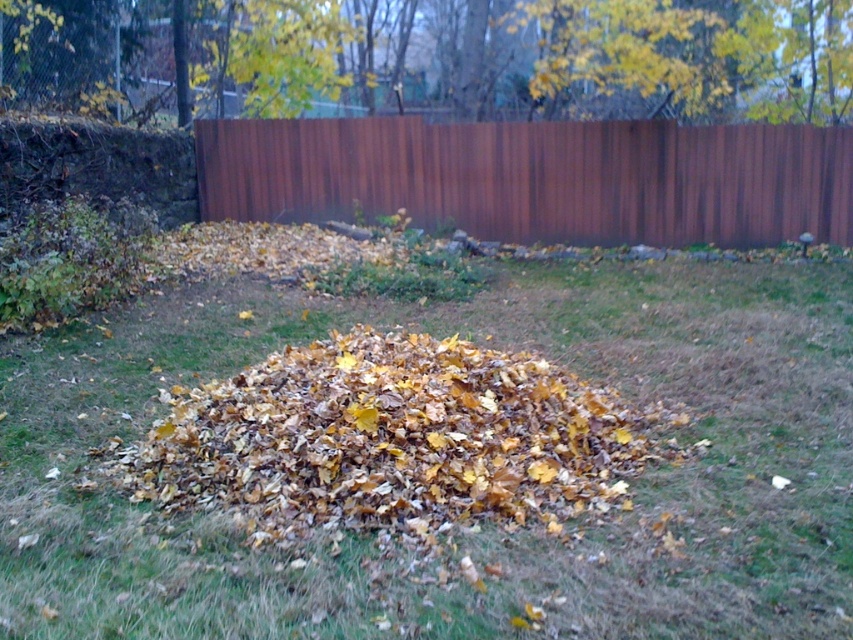
From the picture: Is brown wood fence at center smaller than yellow-green leaves at upper center?

Indeed, brown wood fence at center has a smaller size compared to yellow-green leaves at upper center.

Between brown wood fence at center and yellow-green leaves at upper center, which one has less height?

brown wood fence at center is shorter.

Describe the element at coordinates (537, 177) in the screenshot. I see `brown wood fence at center` at that location.

Locate an element on the screen. brown wood fence at center is located at coordinates (537, 177).

Can you confirm if brown dry grass at center is positioned below brown wood fence at center?

Yes, brown dry grass at center is below brown wood fence at center.

Does brown dry grass at center appear on the left side of brown wood fence at center?

Incorrect, brown dry grass at center is not on the left side of brown wood fence at center.

Between point (172, 624) and point (624, 132), which one is positioned in front?

Point (172, 624)

The image size is (853, 640). Find the location of `brown dry grass at center`. brown dry grass at center is located at coordinates (485, 525).

Does brown dry grass at center have a larger size compared to yellow-green leaves at upper center?

No, brown dry grass at center is not bigger than yellow-green leaves at upper center.

Can you confirm if brown dry grass at center is smaller than yellow-green leaves at upper center?

Yes, brown dry grass at center is smaller than yellow-green leaves at upper center.

What do you see at coordinates (485, 525) in the screenshot?
I see `brown dry grass at center` at bounding box center [485, 525].

The height and width of the screenshot is (640, 853). I want to click on brown dry grass at center, so click(x=485, y=525).